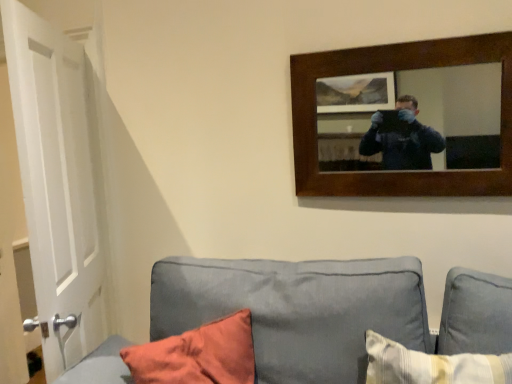
Question: From the image's perspective, is white matte door at left beneath gray fabric couch at lower center?

Choices:
 (A) yes
 (B) no

Answer: (B)

Question: From a real-world perspective, is white matte door at left located higher than gray fabric couch at lower center?

Choices:
 (A) no
 (B) yes

Answer: (B)

Question: From the image's perspective, is white matte door at left above gray fabric couch at lower center?

Choices:
 (A) yes
 (B) no

Answer: (A)

Question: Is white matte door at left looking in the opposite direction of gray fabric couch at lower center?

Choices:
 (A) no
 (B) yes

Answer: (A)

Question: Considering the relative sizes of white matte door at left and gray fabric couch at lower center in the image provided, is white matte door at left shorter than gray fabric couch at lower center?

Choices:
 (A) no
 (B) yes

Answer: (A)

Question: Looking at their shapes, would you say wooden-framed mirror at upper right is wider or thinner than gray fabric couch at lower center?

Choices:
 (A) thin
 (B) wide

Answer: (A)

Question: Considering their positions, is wooden-framed mirror at upper right located in front of or behind gray fabric couch at lower center?

Choices:
 (A) front
 (B) behind

Answer: (B)

Question: Visually, is wooden-framed mirror at upper right positioned to the left or to the right of gray fabric couch at lower center?

Choices:
 (A) left
 (B) right

Answer: (B)

Question: Considering the positions of point (451, 137) and point (73, 369), is point (451, 137) closer or farther from the camera than point (73, 369)?

Choices:
 (A) farther
 (B) closer

Answer: (A)

Question: Considering the positions of gray fabric couch at lower center and wooden-framed mirror at upper right in the image, is gray fabric couch at lower center wider or thinner than wooden-framed mirror at upper right?

Choices:
 (A) thin
 (B) wide

Answer: (B)

Question: Is gray fabric couch at lower center taller or shorter than wooden-framed mirror at upper right?

Choices:
 (A) tall
 (B) short

Answer: (A)

Question: Is gray fabric couch at lower center spatially inside wooden-framed mirror at upper right, or outside of it?

Choices:
 (A) outside
 (B) inside

Answer: (A)

Question: Is point (254, 271) positioned closer to the camera than point (463, 69)?

Choices:
 (A) closer
 (B) farther

Answer: (B)

Question: Is gray fabric couch at lower center to the left or to the right of white matte door at left in the image?

Choices:
 (A) right
 (B) left

Answer: (A)

Question: From the image's perspective, is gray fabric couch at lower center above or below white matte door at left?

Choices:
 (A) below
 (B) above

Answer: (A)